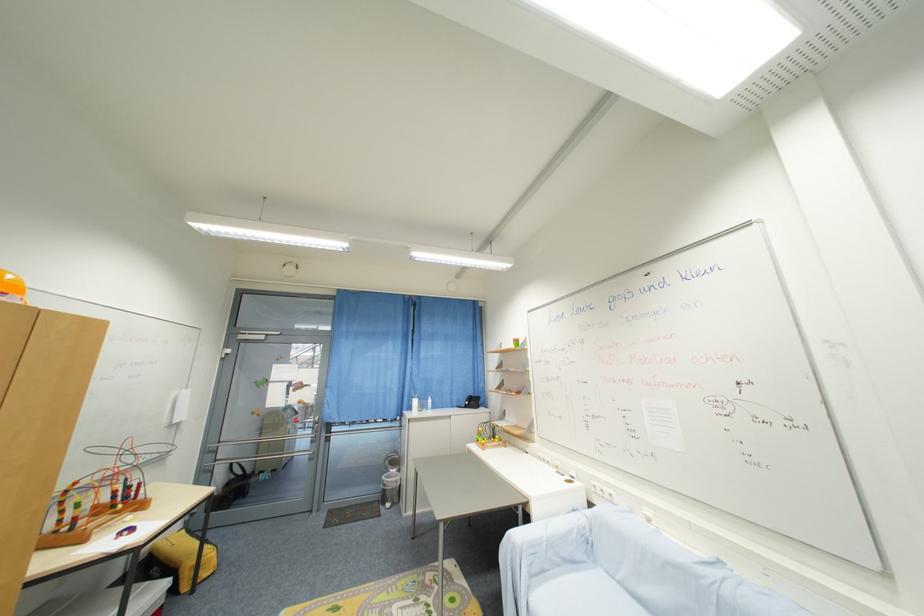
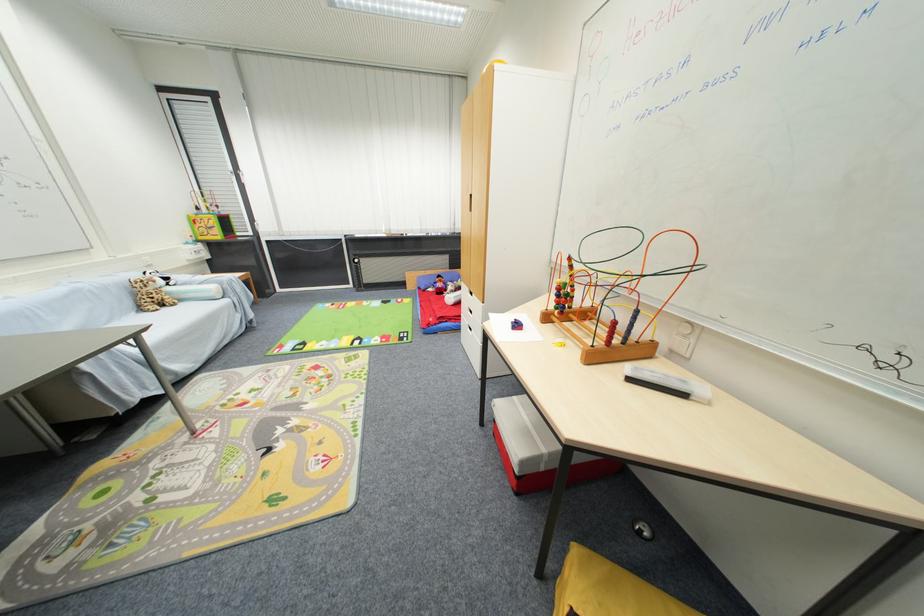
Find the pixel in the second image that matches point (80, 485) in the first image.

(575, 261)